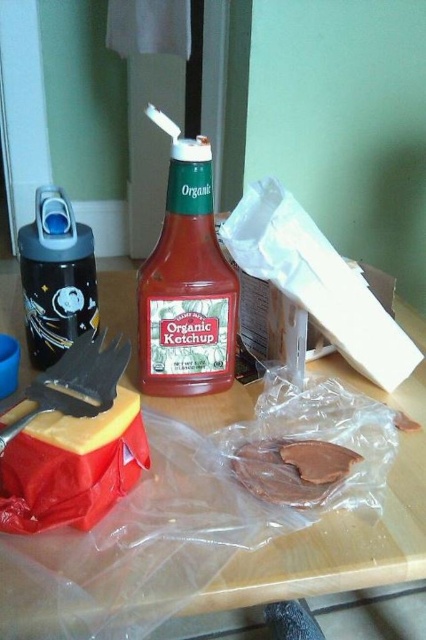
You are at a table with a matte glass bottle of organic ketchup at center and a brown matte chocolate at center. If you want to grab the closest item to you, which one should you reach for?

The matte glass bottle of organic ketchup at center is closer to you than the brown matte chocolate at center, so you should reach for the matte glass bottle of organic ketchup at center.

Consider the image. You have a small toy car that is 10 cm long. You want to place it on the wooden table at center so that it doesn t fall off. Considering the space between the brown matte chocolate at center and the edge of the table, will the toy car fit entirely on the table?

The wooden table at center might be wider than brown matte chocolate at center, so there might be enough space for the toy car to fit without falling off. However, the exact dimensions aren t specified, so it s uncertain.